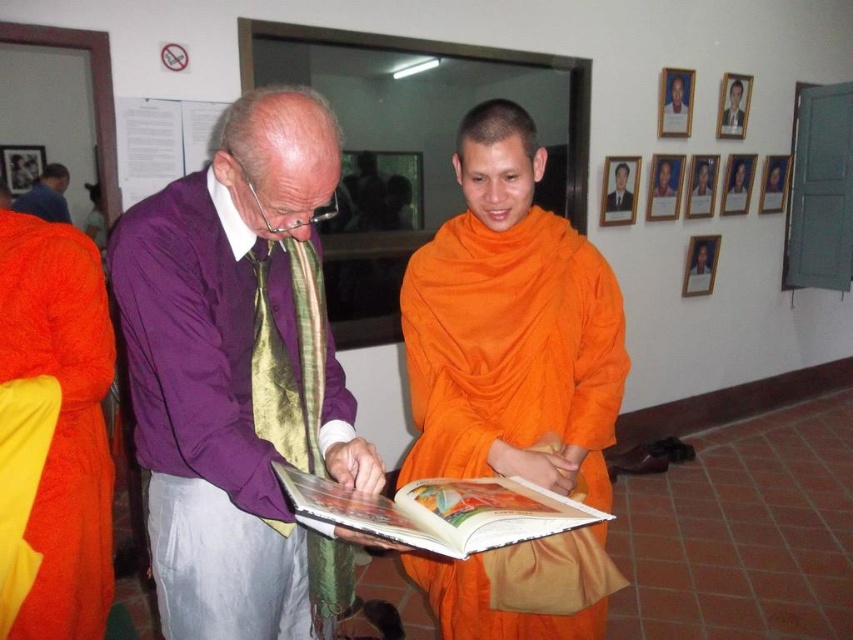
Does purple silk shirt at center come in front of orange silk robe at center?

Yes, purple silk shirt at center is in front of orange silk robe at center.

This screenshot has width=853, height=640. Describe the element at coordinates (239, 376) in the screenshot. I see `purple silk shirt at center` at that location.

Locate an element on the screen. This screenshot has width=853, height=640. purple silk shirt at center is located at coordinates (239, 376).

What do you see at coordinates (439, 512) in the screenshot? The width and height of the screenshot is (853, 640). I see `orange cloth book at center` at bounding box center [439, 512].

Between orange cloth book at center and orange cloth at center, which one is positioned higher?

orange cloth at center

What are the coordinates of `orange cloth book at center` in the screenshot? It's located at (439, 512).

Does orange silk robe at left appear on the right side of purple silk tie at center?

Correct, you'll find orange silk robe at left to the right of purple silk tie at center.

Who is higher up, orange silk robe at left or purple silk tie at center?

purple silk tie at center

The image size is (853, 640). In order to click on orange silk robe at left in this screenshot , I will do `click(62, 417)`.